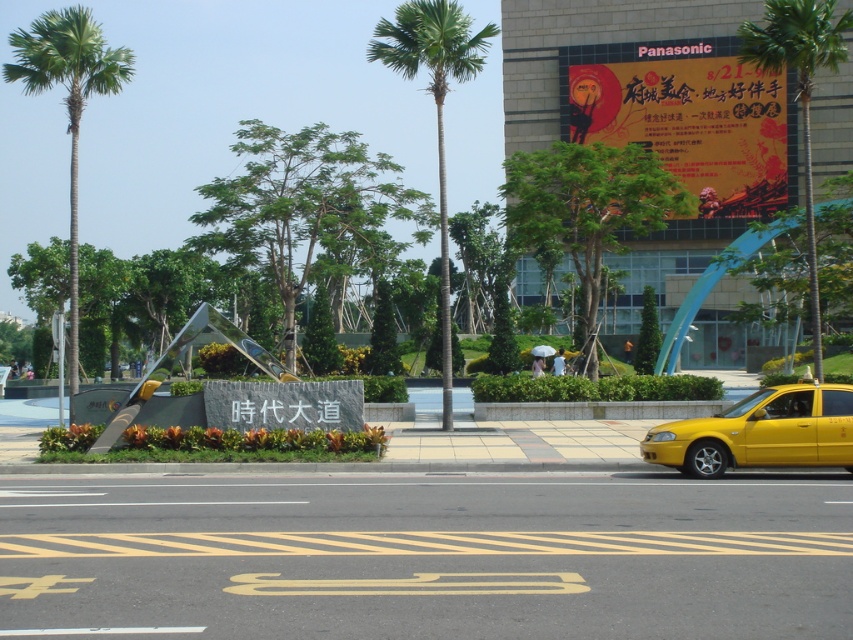
Is green leafy palm tree at left above green leafy palm tree at center?

Incorrect, green leafy palm tree at left is not positioned above green leafy palm tree at center.

Which is in front, point (9, 81) or point (457, 68)?

Positioned in front is point (457, 68).

Locate an element on the screen. This screenshot has height=640, width=853. green leafy palm tree at left is located at coordinates (68, 104).

Consider the image. Does green leafy palm tree at center have a lesser width compared to green leafy palm tree at upper right?

Yes.

Where is `green leafy palm tree at center`? green leafy palm tree at center is located at coordinates (434, 108).

Which is behind, point (491, 36) or point (788, 22)?

Positioned behind is point (491, 36).

At what (x,y) coordinates should I click in order to perform the action: click on green leafy palm tree at center. Please return your answer as a coordinate pair (x, y). Looking at the image, I should click on point(434,108).

Which is behind, point (778, 186) or point (686, 460)?

Positioned behind is point (778, 186).

Is matte plastic billboard at upper center to the right of yellow matte taxi at lower right from the viewer's perspective?

Correct, you'll find matte plastic billboard at upper center to the right of yellow matte taxi at lower right.

Does point (680, 164) lie in front of point (845, 442)?

No, it is not.

The image size is (853, 640). Find the location of `matte plastic billboard at upper center`. matte plastic billboard at upper center is located at coordinates (685, 116).